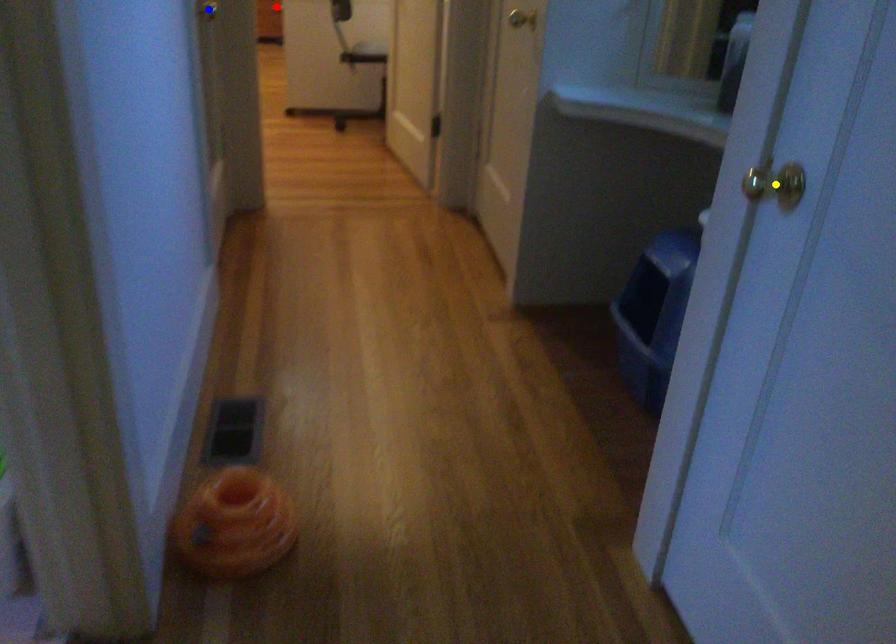
Order these from nearest to farthest:
red point
blue point
yellow point

red point
blue point
yellow point